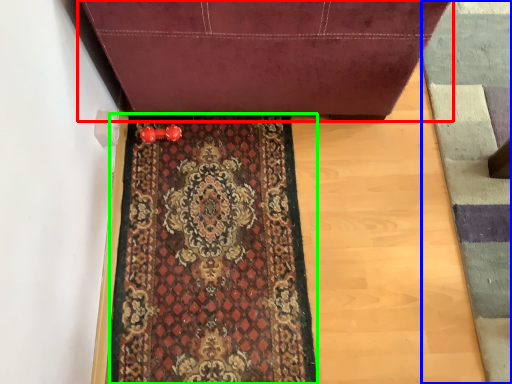
Question: Estimate the real-world distances between objects in this image. Which object is farther from furniture (highlighted by a red box), doormat (highlighted by a blue box) or mat (highlighted by a green box)?

Choices:
 (A) doormat
 (B) mat

Answer: (A)